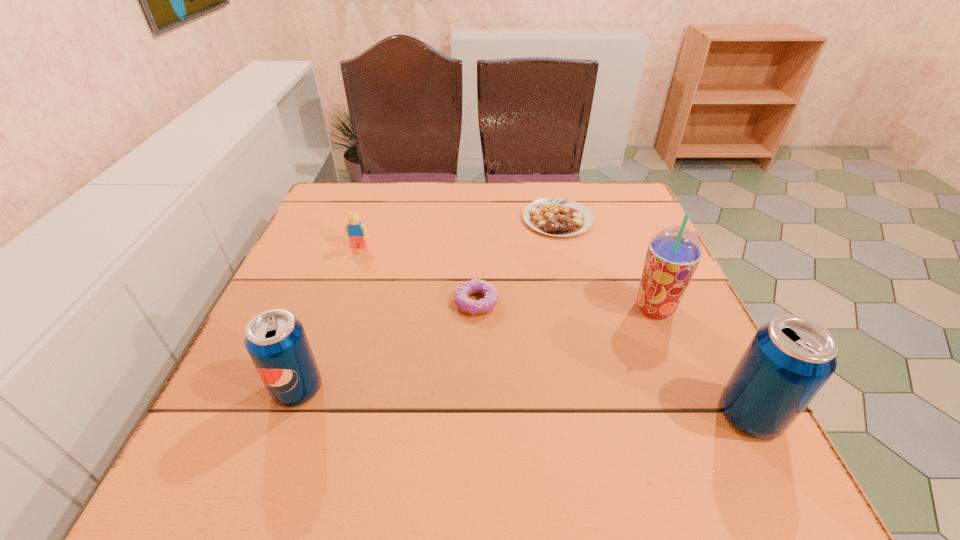
Image resolution: width=960 pixels, height=540 pixels. In order to click on vacant space located 0.120m on the right of the third tallest object in this screenshot , I will do `click(391, 388)`.

The width and height of the screenshot is (960, 540). What are the coordinates of `vacant region located 0.250m on the left of the fifth shortest object` in the screenshot? It's located at (569, 414).

Where is `free location located on the front of the steak`? Image resolution: width=960 pixels, height=540 pixels. free location located on the front of the steak is located at coordinates (571, 279).

The height and width of the screenshot is (540, 960). I want to click on vacant region located 0.150m on the front-facing side of the fourth tallest object, so click(343, 293).

Identify the location of free space located on the back of the tallest object. (622, 231).

The width and height of the screenshot is (960, 540). Identify the location of free space located on the front of the fourth object from right to left. (475, 389).

This screenshot has width=960, height=540. What are the coordinates of `object that is at the far edge` in the screenshot? It's located at (559, 217).

Locate an element on the screen. Image resolution: width=960 pixels, height=540 pixels. pop soda located at the left edge is located at coordinates (276, 341).

In order to click on Lego located in the left edge section of the desktop in this screenshot , I will do `click(357, 232)`.

Where is `pop soda that is at the right edge`? This screenshot has height=540, width=960. pop soda that is at the right edge is located at coordinates (788, 361).